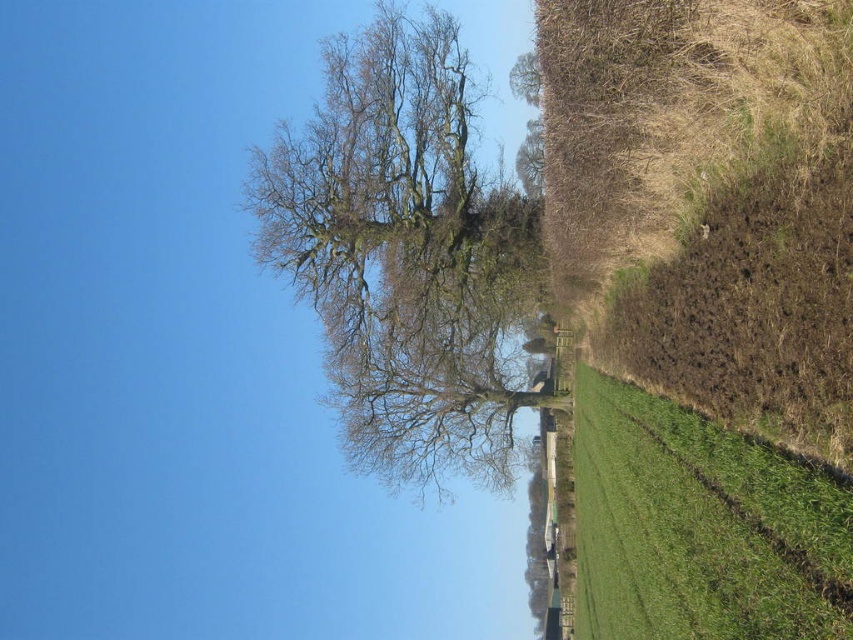
Who is positioned more to the left, bare branches tree at center or green grassy field at right?

From the viewer's perspective, bare branches tree at center appears more on the left side.

Is bare branches tree at center to the left of green grassy field at right from the viewer's perspective?

Yes, bare branches tree at center is to the left of green grassy field at right.

Who is more forward, (323,228) or (706,461)?

Point (706,461)

Where is `bare branches tree at center`? This screenshot has width=853, height=640. bare branches tree at center is located at coordinates (404, 253).